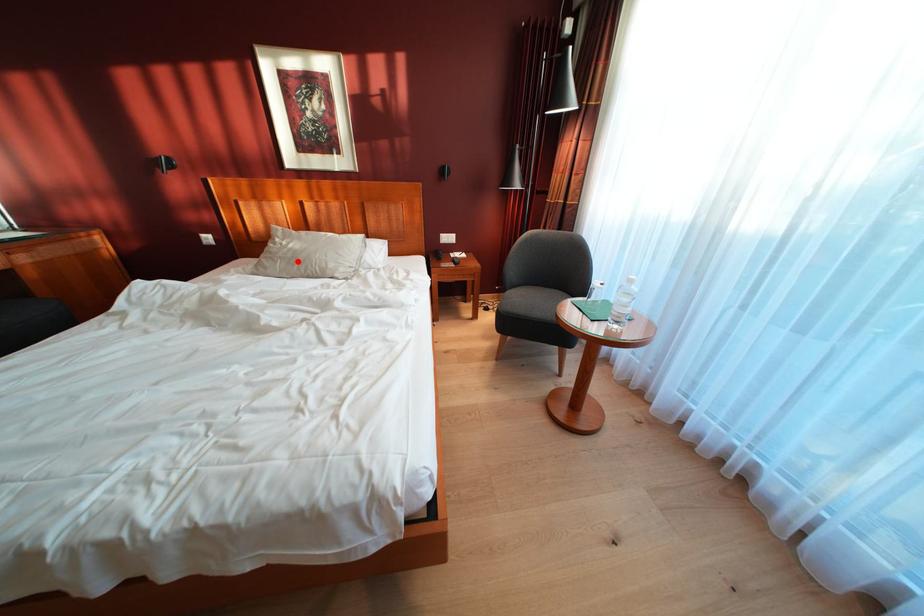
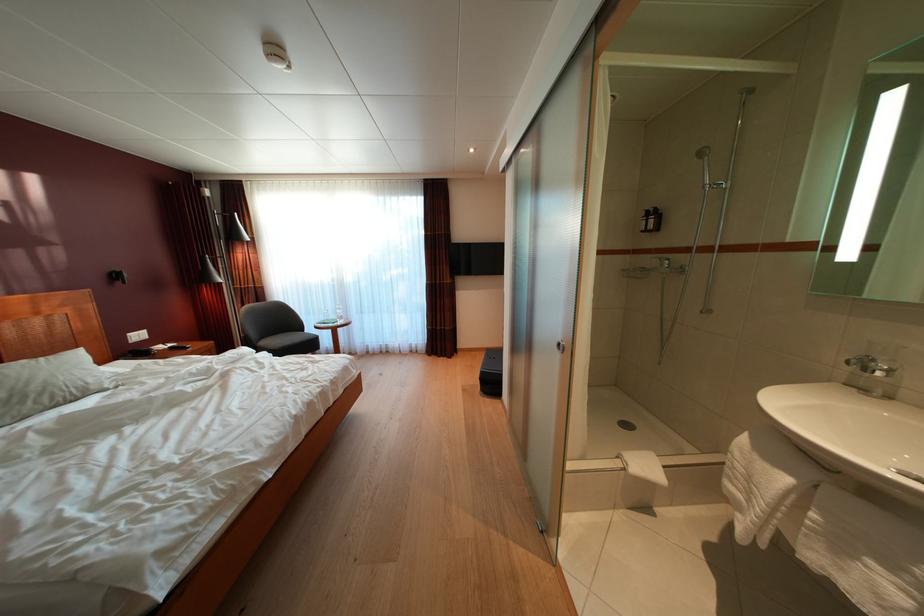
Locate, in the second image, the point that corresponds to the highlighted location in the first image.

(10, 400)